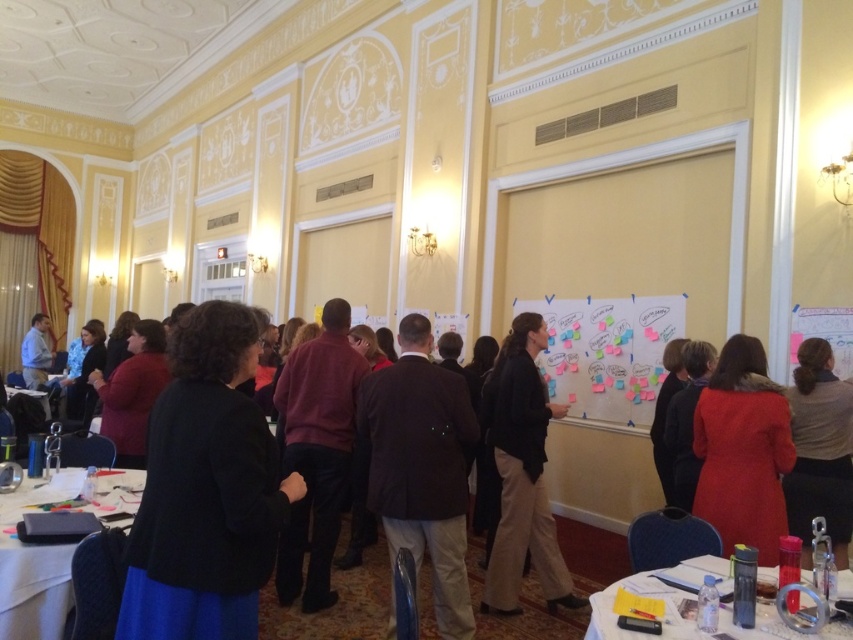
Does point (323, 397) lie in front of point (656, 388)?

Yes.

At what (x,y) coordinates should I click in order to perform the action: click on maroon sweater at center. Please return your answer as a coordinate pair (x, y). This screenshot has height=640, width=853. Looking at the image, I should click on (316, 451).

Is point (813, 445) in front of point (827, 625)?

No, (813, 445) is behind (827, 625).

Does gray fabric jacket at center appear on the left side of translucent plastic water bottle at lower right?

In fact, gray fabric jacket at center is to the right of translucent plastic water bottle at lower right.

Describe the element at coordinates (820, 451) in the screenshot. I see `gray fabric jacket at center` at that location.

Identify the location of gray fabric jacket at center. (820, 451).

Does black matte jacket at center have a greater height compared to translucent plastic water bottle at lower right?

Indeed, black matte jacket at center has a greater height compared to translucent plastic water bottle at lower right.

Which is more to the right, black matte jacket at center or translucent plastic water bottle at lower right?

translucent plastic water bottle at lower right

Between point (183, 324) and point (692, 595), which one is positioned in front?

Point (183, 324) is in front.

In order to click on black matte jacket at center in this screenshot , I will do `click(206, 490)`.